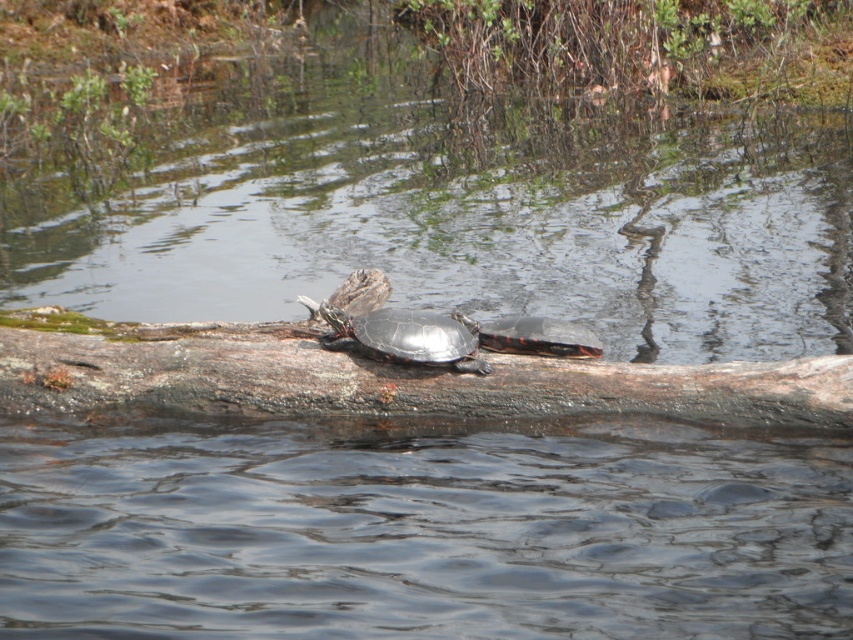
Consider the image. You are a photographer trying to capture the smooth brown log at center and the shiny black turtle at center in the same frame. Based on their sizes, which object should you focus on first to ensure both are in focus?

The smooth brown log at center is much taller than the shiny black turtle at center, so focusing on the log first will help ensure both are in focus since it is larger and more prominent in the scene.

You are standing at the edge of the water and see the shiny black turtle at center. If you want to reach it without disturbing the water, which direction should you move in relation to the turtle?

The shiny black turtle at center is located at point coordinates of [403,337]. To reach it without disturbing the water, you should move directly towards its position, aligning your path with the turtle while maintaining a steady and quiet approach to avoid causing ripples.